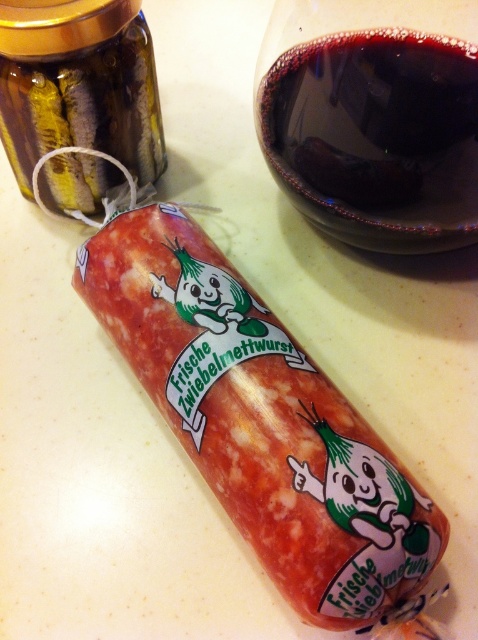
Question: Among these objects, which one is farthest from the camera?

Choices:
 (A) matte pinkish-red sausage at center
 (B) translucent amber glass jar at upper left
 (C) dark red glass at upper right

Answer: (B)

Question: Among these objects, which one is nearest to the camera?

Choices:
 (A) dark red glass at upper right
 (B) matte pinkish-red sausage at center

Answer: (B)

Question: Can you confirm if matte pinkish-red sausage at center is smaller than dark red glass at upper right?

Choices:
 (A) no
 (B) yes

Answer: (A)

Question: Does dark red glass at upper right have a larger size compared to translucent amber glass jar at upper left?

Choices:
 (A) no
 (B) yes

Answer: (B)

Question: Which object is closer to the camera taking this photo?

Choices:
 (A) translucent amber glass jar at upper left
 (B) dark red glass at upper right

Answer: (B)

Question: Is dark red glass at upper right wider than translucent amber glass jar at upper left?

Choices:
 (A) yes
 (B) no

Answer: (A)